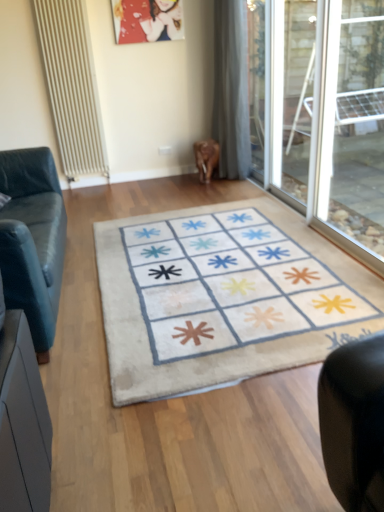
Question: Would you say beige fabric doormat at center is inside or outside matte plastic picture frame at upper center?

Choices:
 (A) outside
 (B) inside

Answer: (A)

Question: From a real-world perspective, is beige fabric doormat at center positioned above or below matte plastic picture frame at upper center?

Choices:
 (A) below
 (B) above

Answer: (A)

Question: Based on their relative distances, which object is nearer to the beige fabric doormat at center?

Choices:
 (A) matte plastic picture frame at upper center
 (B) transparent glass window at right
 (C) beige textured radiator at left
 (D) gray fabric curtain at center
 (E) leather couch at left

Answer: (E)

Question: Estimate the real-world distances between objects in this image. Which object is farther from the transparent glass window at right?

Choices:
 (A) beige fabric doormat at center
 (B) leather couch at left
 (C) beige textured radiator at left
 (D) matte plastic picture frame at upper center
 (E) gray fabric curtain at center

Answer: (C)